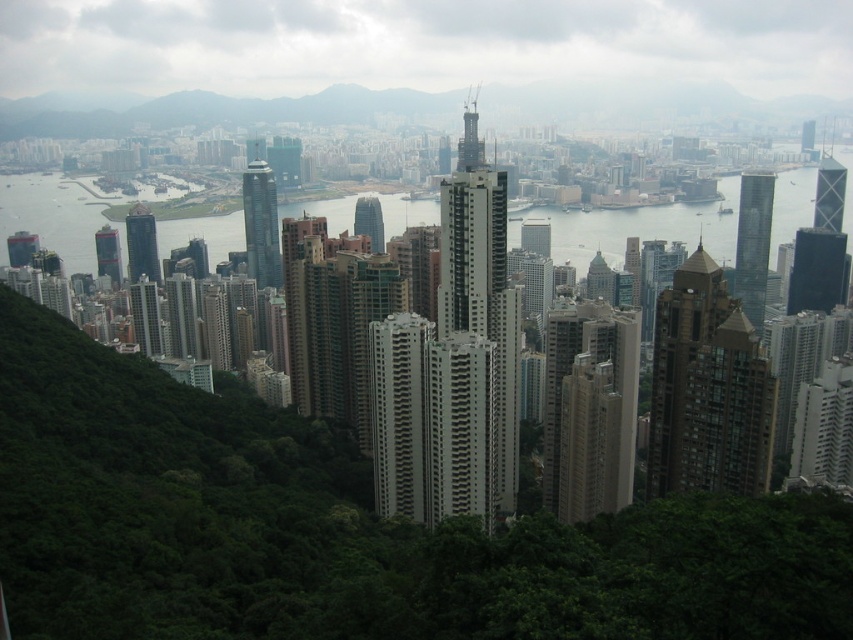
You are a city planner evaluating the skyline of this urban area. You notice the brown glassy building at center and the glassy blue skyscraper at center. Which of these two structures has a larger footprint in terms of floor area?

The brown glassy building at center is bigger than the glassy blue skyscraper at center, so it has a larger footprint in terms of floor area.

Consider the image. You are standing at the base of the hillside in the foreground of the image. You see two points marked in the scene, point 1 at coordinates point (653, 464) and point 2 at coordinates point (376, 205). Which point is closer to you?

Point (376, 205) is closer to you because it is less further away than point (653, 464), which is further away from the camera.

You are an architect evaluating the urban layout. You notice the glassy reflective skyscraper at right and the glassy skyscraper at center. Which of these two skyscrapers is located to the left of the other?

The glassy reflective skyscraper at right is positioned on the left side of the glassy skyscraper at center.